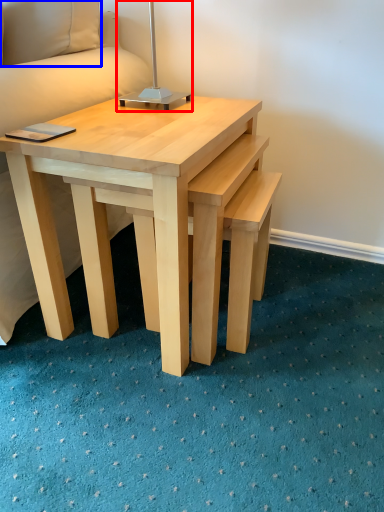
Question: Which point is further to the camera, bedside lamp (highlighted by a red box) or pillow (highlighted by a blue box)?

Choices:
 (A) bedside lamp
 (B) pillow

Answer: (B)